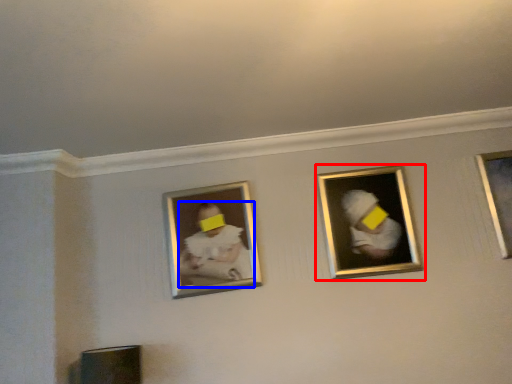
Question: Which of the following is the farthest to the observer, picture frame (highlighted by a red box) or person (highlighted by a blue box)?

Choices:
 (A) picture frame
 (B) person

Answer: (B)